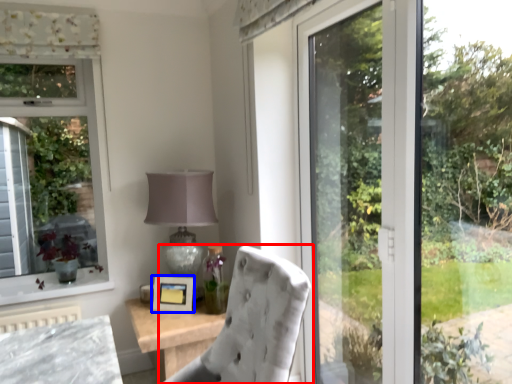
Question: Among these objects, which one is nearest to the camera, chair (highlighted by a red box) or picture frame (highlighted by a blue box)?

Choices:
 (A) chair
 (B) picture frame

Answer: (A)